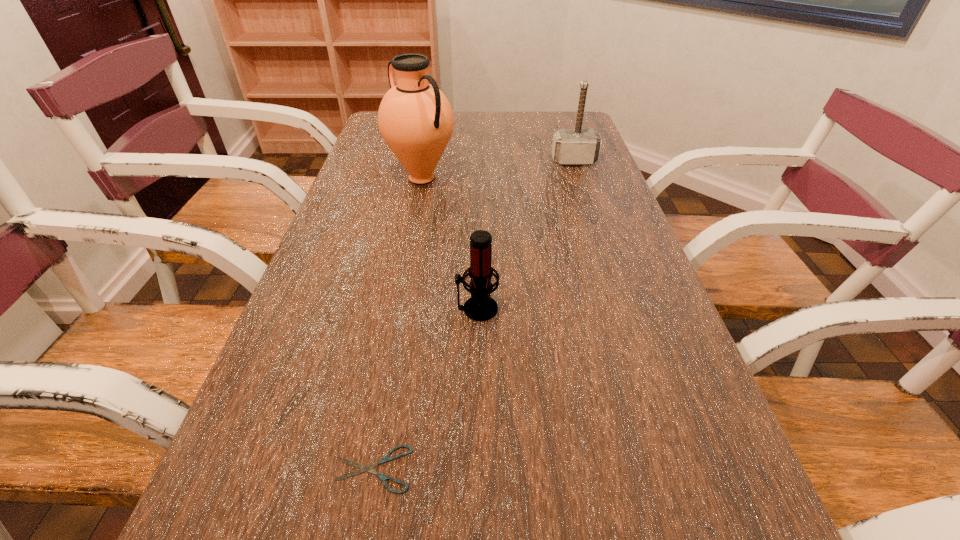
Find the location of a particular element. Image resolution: width=960 pixels, height=540 pixels. vacant area between the third tallest object and the pitcher is located at coordinates (449, 244).

You are a GUI agent. You are given a task and a screenshot of the screen. Output one action in this format:
    pyautogui.click(x=<x>, y=<y>)
    Task: Click on the free space between the hammer and the third farthest object
    
    Given the screenshot: What is the action you would take?
    pyautogui.click(x=525, y=235)

The width and height of the screenshot is (960, 540). I want to click on empty space between the rightmost object and the tallest object, so click(498, 170).

This screenshot has height=540, width=960. I want to click on vacant area that lies between the tallest object and the hammer, so pyautogui.click(x=498, y=170).

This screenshot has height=540, width=960. Identify the location of vacant region between the hammer and the third object from left to right. pyautogui.click(x=525, y=235).

I want to click on free space between the tallest object and the third tallest object, so click(449, 244).

Image resolution: width=960 pixels, height=540 pixels. In order to click on object identified as the closest to the hammer in this screenshot , I will do `click(415, 119)`.

Where is `the closest object to the second object from right to left`? the closest object to the second object from right to left is located at coordinates (386, 458).